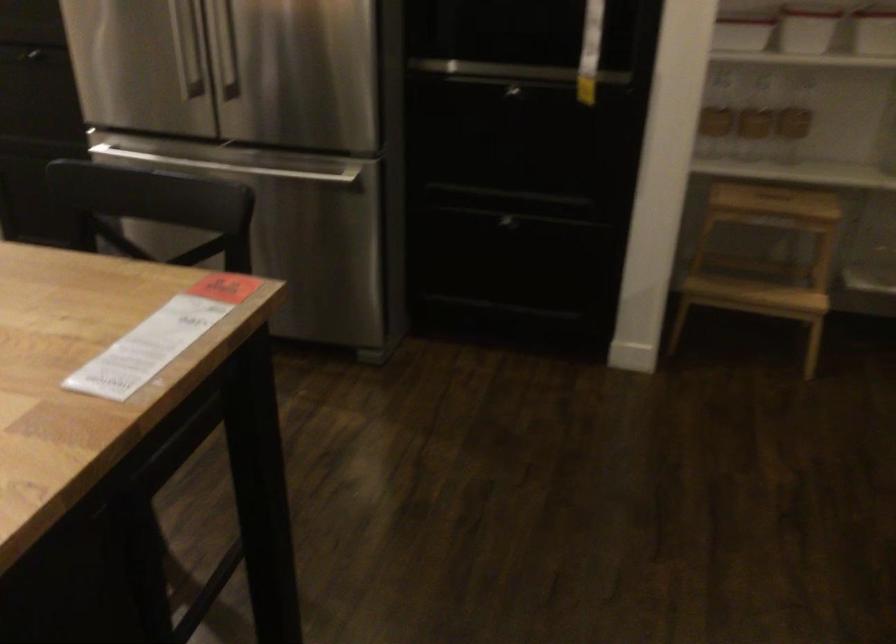
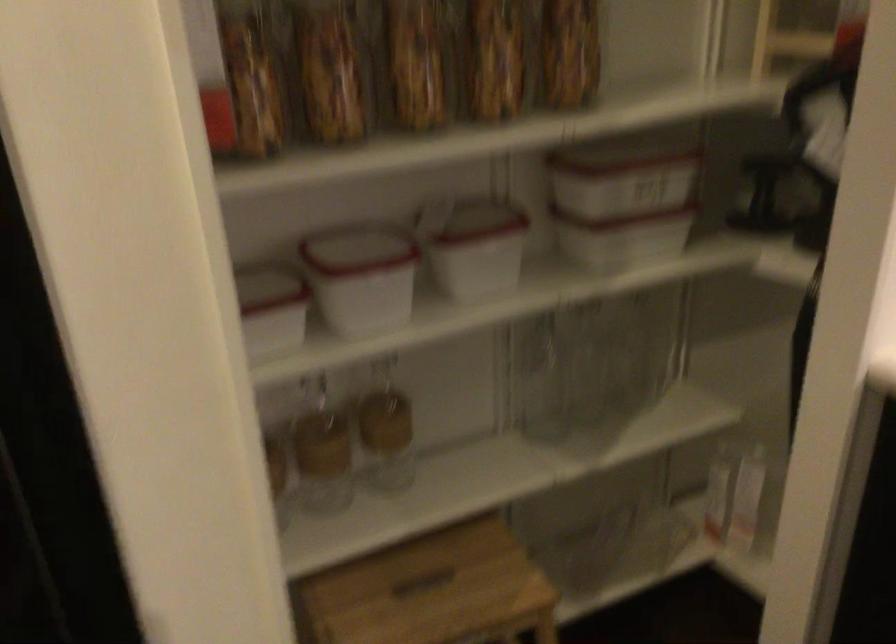
Locate, in the second image, the point that corresponds to point 790,190 in the first image.

(428, 565)